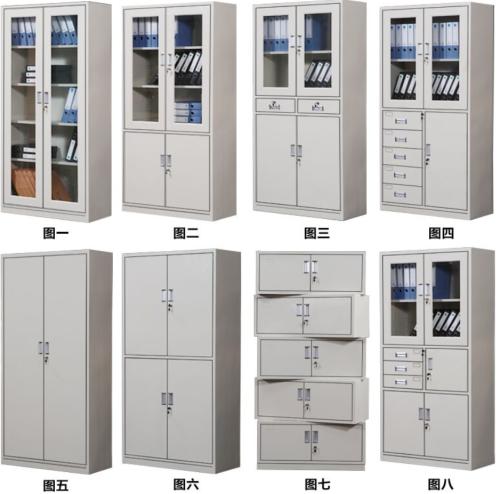
This screenshot has height=494, width=500. I want to click on books inside glass door cabinets, so click(x=65, y=36), click(x=444, y=328), click(x=457, y=87), click(x=410, y=87), click(x=318, y=75), click(x=186, y=72), click(x=29, y=149), click(x=28, y=70).